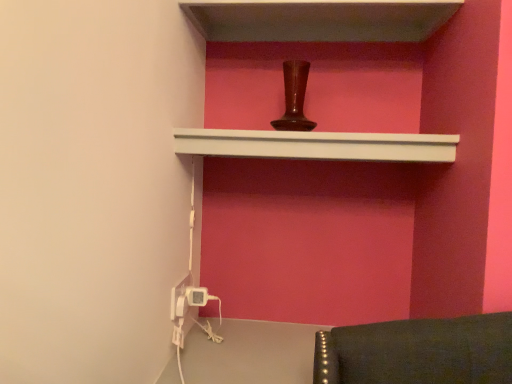
The height and width of the screenshot is (384, 512). Describe the element at coordinates (179, 298) in the screenshot. I see `white plastic electric outlet at lower left, which is the first electric outlet in left-to-right order` at that location.

Where is `white matte shelf at upper center, acting as the 1th shelf starting from the bottom`? The height and width of the screenshot is (384, 512). white matte shelf at upper center, acting as the 1th shelf starting from the bottom is located at coordinates (317, 145).

You are a GUI agent. You are given a task and a screenshot of the screen. Output one action in this format:
    pyautogui.click(x=<x>, y=<y>)
    Task: Click on the smooth white shelf at upper center, which is counted as the second shelf, starting from the bottom
    The height and width of the screenshot is (384, 512).
    Given the screenshot: What is the action you would take?
    pyautogui.click(x=318, y=19)

Is smooth white shelf at upper center, which is counted as the second shelf, starting from the bottom, facing away from white matte shelf at upper center, which ranks as the second shelf in top-to-bottom order?

No, smooth white shelf at upper center, which is counted as the second shelf, starting from the bottom, is not facing the opposite direction of white matte shelf at upper center, which ranks as the second shelf in top-to-bottom order.

From a real-world perspective, which object rests below the other?

In real-world perspective, white matte shelf at upper center, which ranks as the second shelf in top-to-bottom order, is lower.

Between smooth white shelf at upper center, which is counted as the second shelf, starting from the bottom, and white matte shelf at upper center, acting as the 1th shelf starting from the bottom, which one has larger size?

Bigger between the two is smooth white shelf at upper center, which is counted as the second shelf, starting from the bottom.

Between smooth white shelf at upper center, which is counted as the second shelf, starting from the bottom, and white matte shelf at upper center, acting as the 1th shelf starting from the bottom, which one has smaller width?

white matte shelf at upper center, acting as the 1th shelf starting from the bottom.

Between white matte shelf at upper center, acting as the 1th shelf starting from the bottom, and white plastic electric outlet at lower left, which is the second electric outlet from right to left, which one has smaller size?

white plastic electric outlet at lower left, which is the second electric outlet from right to left, is smaller.

Is white matte shelf at upper center, acting as the 1th shelf starting from the bottom, not near white plastic electric outlet at lower left, which is the second electric outlet from right to left?

No, white matte shelf at upper center, acting as the 1th shelf starting from the bottom, is in close proximity to white plastic electric outlet at lower left, which is the second electric outlet from right to left.

I want to click on the 2nd electric outlet to the left of the white matte shelf at upper center, which ranks as the second shelf in top-to-bottom order, counting from the anchor's position, so click(179, 298).

Can you confirm if white matte shelf at upper center, acting as the 1th shelf starting from the bottom, is shorter than white plastic electric outlet at lower left, which is the first electric outlet in left-to-right order?

In fact, white matte shelf at upper center, acting as the 1th shelf starting from the bottom, may be taller than white plastic electric outlet at lower left, which is the first electric outlet in left-to-right order.

Is white plastic electric outlet at lower left, which is the first electric outlet in left-to-right order, not within white matte shelf at upper center, which ranks as the second shelf in top-to-bottom order?

white plastic electric outlet at lower left, which is the first electric outlet in left-to-right order, lies outside white matte shelf at upper center, which ranks as the second shelf in top-to-bottom order,'s area.

Does white plastic electric outlet at lower left, which is the first electric outlet in left-to-right order, appear on the left side of white matte shelf at upper center, which ranks as the second shelf in top-to-bottom order?

Indeed, white plastic electric outlet at lower left, which is the first electric outlet in left-to-right order, is positioned on the left side of white matte shelf at upper center, which ranks as the second shelf in top-to-bottom order.

From the image's perspective, is white plastic electric outlet at lower left, which is the second electric outlet from right to left, located beneath white matte shelf at upper center, acting as the 1th shelf starting from the bottom?

Yes.

Who is taller, white plastic electric outlet at lower left, which is the second electric outlet from right to left, or white matte shelf at upper center, which ranks as the second shelf in top-to-bottom order?

Standing taller between the two is white matte shelf at upper center, which ranks as the second shelf in top-to-bottom order.

Which point is more distant from viewer, (204,293) or (173,287)?

Positioned behind is point (204,293).

From a real-world perspective, which object rests below the other?

white plastic electric outlet at lower left, arranged as the first electric outlet when viewed from the right, from a real-world perspective.

Can you confirm if white plastic electric outlet at lower left, arranged as the second electric outlet when viewed from the left, is wider than white plastic electric outlet at lower left, which is the second electric outlet from right to left?

Yes, white plastic electric outlet at lower left, arranged as the second electric outlet when viewed from the left, is wider than white plastic electric outlet at lower left, which is the second electric outlet from right to left.

How many degrees apart are the facing directions of white plastic electric outlet at lower left, arranged as the second electric outlet when viewed from the left, and white plastic electric outlet at lower left, which is the first electric outlet in left-to-right order?

white plastic electric outlet at lower left, arranged as the second electric outlet when viewed from the left, and white plastic electric outlet at lower left, which is the first electric outlet in left-to-right order, are facing 0.0547 degrees away from each other.

Which of these two, white matte shelf at upper center, which ranks as the second shelf in top-to-bottom order, or smooth white shelf at upper center, which is counted as the second shelf, starting from the bottom, stands taller?

Standing taller between the two is white matte shelf at upper center, which ranks as the second shelf in top-to-bottom order.

Is white matte shelf at upper center, which ranks as the second shelf in top-to-bottom order, turned away from smooth white shelf at upper center, which is counted as the second shelf, starting from the bottom?

No, smooth white shelf at upper center, which is counted as the second shelf, starting from the bottom, is not at the back of white matte shelf at upper center, which ranks as the second shelf in top-to-bottom order.

Identify the location of shelf below the smooth white shelf at upper center, which ranks as the 1th shelf in top-to-bottom order (from the image's perspective). The width and height of the screenshot is (512, 384). (317, 145).

Consider the image. Is white matte shelf at upper center, acting as the 1th shelf starting from the bottom, not inside smooth white shelf at upper center, which ranks as the 1th shelf in top-to-bottom order?

Yes, white matte shelf at upper center, acting as the 1th shelf starting from the bottom, is located beyond the bounds of smooth white shelf at upper center, which ranks as the 1th shelf in top-to-bottom order.

Identify the location of the 1st shelf to the right when counting from the white plastic electric outlet at lower left, arranged as the second electric outlet when viewed from the left. (x=317, y=145).

Which is closer to the camera, (197, 290) or (265, 147)?

The point (265, 147) is in front.

Looking at this image, could you tell me if white plastic electric outlet at lower left, arranged as the second electric outlet when viewed from the left, is facing white matte shelf at upper center, which ranks as the second shelf in top-to-bottom order?

No, white plastic electric outlet at lower left, arranged as the second electric outlet when viewed from the left, does not turn towards white matte shelf at upper center, which ranks as the second shelf in top-to-bottom order.

Is white plastic electric outlet at lower left, arranged as the second electric outlet when viewed from the left, at the left side of smooth white shelf at upper center, which is counted as the second shelf, starting from the bottom?

Correct, you'll find white plastic electric outlet at lower left, arranged as the second electric outlet when viewed from the left, to the left of smooth white shelf at upper center, which is counted as the second shelf, starting from the bottom.

Does white plastic electric outlet at lower left, arranged as the second electric outlet when viewed from the left, have a lesser height compared to smooth white shelf at upper center, which is counted as the second shelf, starting from the bottom?

Yes, white plastic electric outlet at lower left, arranged as the second electric outlet when viewed from the left, is shorter than smooth white shelf at upper center, which is counted as the second shelf, starting from the bottom.

From the image's perspective, is white plastic electric outlet at lower left, arranged as the first electric outlet when viewed from the right, under smooth white shelf at upper center, which is counted as the second shelf, starting from the bottom?

Indeed, from the image's perspective, white plastic electric outlet at lower left, arranged as the first electric outlet when viewed from the right, is shown beneath smooth white shelf at upper center, which is counted as the second shelf, starting from the bottom.

The height and width of the screenshot is (384, 512). In the image, there is a smooth white shelf at upper center, which ranks as the 1th shelf in top-to-bottom order. What are the coordinates of `shelf below it (from a real-world perspective)` in the screenshot? It's located at [317, 145].

This screenshot has width=512, height=384. I want to click on the 1st electric outlet below the white matte shelf at upper center, acting as the 1th shelf starting from the bottom (from the image's perspective), so click(x=179, y=298).

When comparing their distances from smooth white shelf at upper center, which is counted as the second shelf, starting from the bottom, does white matte shelf at upper center, acting as the 1th shelf starting from the bottom, or white plastic electric outlet at lower left, which is the second electric outlet from right to left, seem closer?

white matte shelf at upper center, acting as the 1th shelf starting from the bottom, lies closer to smooth white shelf at upper center, which is counted as the second shelf, starting from the bottom, than the other object.

Looking at the image, which one is located further to white matte shelf at upper center, acting as the 1th shelf starting from the bottom, white plastic electric outlet at lower left, arranged as the first electric outlet when viewed from the right, or white plastic electric outlet at lower left, which is the first electric outlet in left-to-right order?

Among the two, white plastic electric outlet at lower left, arranged as the first electric outlet when viewed from the right, is located further to white matte shelf at upper center, acting as the 1th shelf starting from the bottom.

Which object lies nearer to the anchor point white plastic electric outlet at lower left, which is the first electric outlet in left-to-right order, white plastic electric outlet at lower left, arranged as the first electric outlet when viewed from the right, or white matte shelf at upper center, which ranks as the second shelf in top-to-bottom order?

white plastic electric outlet at lower left, arranged as the first electric outlet when viewed from the right, lies closer to white plastic electric outlet at lower left, which is the first electric outlet in left-to-right order, than the other object.

Based on the photo, estimate the real-world distances between objects in this image. Which object is closer to smooth white shelf at upper center, which is counted as the second shelf, starting from the bottom, white plastic electric outlet at lower left, arranged as the second electric outlet when viewed from the left, or white plastic electric outlet at lower left, which is the second electric outlet from right to left?

white plastic electric outlet at lower left, which is the second electric outlet from right to left, is positioned closer to the anchor smooth white shelf at upper center, which is counted as the second shelf, starting from the bottom.

Based on their spatial positions, is white plastic electric outlet at lower left, arranged as the second electric outlet when viewed from the left, or white matte shelf at upper center, which ranks as the second shelf in top-to-bottom order, closer to smooth white shelf at upper center, which is counted as the second shelf, starting from the bottom?

white matte shelf at upper center, which ranks as the second shelf in top-to-bottom order.

Considering their positions, is white plastic electric outlet at lower left, which is the first electric outlet in left-to-right order, positioned closer to smooth white shelf at upper center, which ranks as the 1th shelf in top-to-bottom order, than white plastic electric outlet at lower left, arranged as the first electric outlet when viewed from the right?

white plastic electric outlet at lower left, which is the first electric outlet in left-to-right order, is closer to smooth white shelf at upper center, which ranks as the 1th shelf in top-to-bottom order.

Considering their positions, is white plastic electric outlet at lower left, arranged as the first electric outlet when viewed from the right, positioned further to white matte shelf at upper center, acting as the 1th shelf starting from the bottom, than smooth white shelf at upper center, which is counted as the second shelf, starting from the bottom?

The object further to white matte shelf at upper center, acting as the 1th shelf starting from the bottom, is white plastic electric outlet at lower left, arranged as the first electric outlet when viewed from the right.

Which object lies further to the anchor point white plastic electric outlet at lower left, which is the first electric outlet in left-to-right order, white matte shelf at upper center, which ranks as the second shelf in top-to-bottom order, or white plastic electric outlet at lower left, arranged as the first electric outlet when viewed from the right?

white matte shelf at upper center, which ranks as the second shelf in top-to-bottom order, is positioned further to the anchor white plastic electric outlet at lower left, which is the first electric outlet in left-to-right order.

At what (x,y) coordinates should I click in order to perform the action: click on shelf between smooth white shelf at upper center, which is counted as the second shelf, starting from the bottom, and white plastic electric outlet at lower left, arranged as the first electric outlet when viewed from the right, in the up-down direction. Please return your answer as a coordinate pair (x, y). Image resolution: width=512 pixels, height=384 pixels. Looking at the image, I should click on (317, 145).

At what (x,y) coordinates should I click in order to perform the action: click on electric outlet between white matte shelf at upper center, acting as the 1th shelf starting from the bottom, and white plastic electric outlet at lower left, arranged as the second electric outlet when viewed from the left, in the vertical direction. Please return your answer as a coordinate pair (x, y). Looking at the image, I should click on (179, 298).

I want to click on electric outlet between smooth white shelf at upper center, which ranks as the 1th shelf in top-to-bottom order, and white plastic electric outlet at lower left, arranged as the second electric outlet when viewed from the left, from top to bottom, so click(x=179, y=298).

You are a GUI agent. You are given a task and a screenshot of the screen. Output one action in this format:
    pyautogui.click(x=<x>, y=<y>)
    Task: Click on the shelf between smooth white shelf at upper center, which is counted as the second shelf, starting from the bottom, and white plastic electric outlet at lower left, which is the second electric outlet from right to left, in the vertical direction
    This screenshot has width=512, height=384.
    Given the screenshot: What is the action you would take?
    pyautogui.click(x=317, y=145)